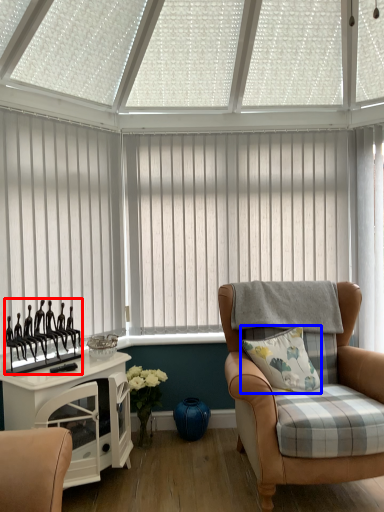
Question: Which point is closer to the camera, showcase (highlighted by a red box) or pillow (highlighted by a blue box)?

Choices:
 (A) showcase
 (B) pillow

Answer: (A)